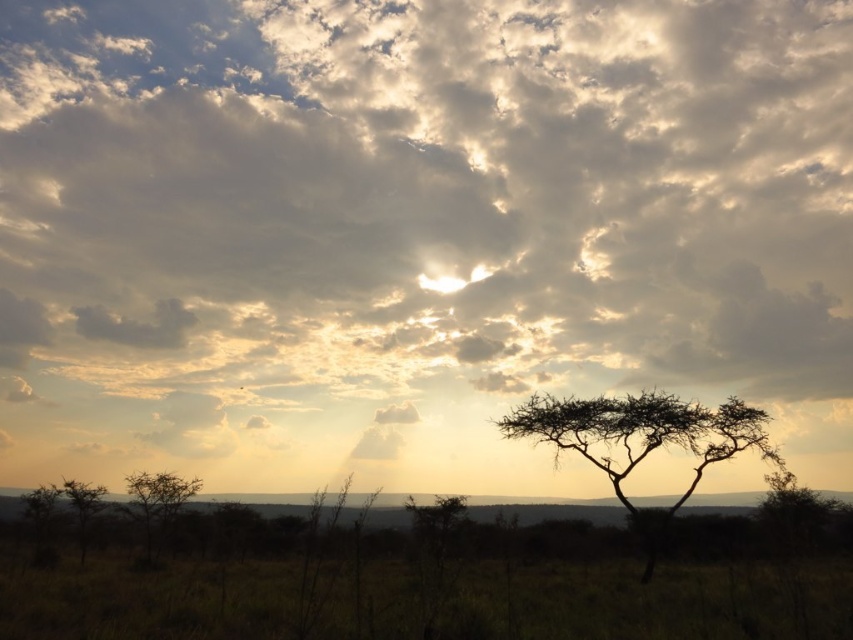
Question: Can you confirm if silhouette wood tree at center is thinner than green leafy tree at lower left?

Choices:
 (A) yes
 (B) no

Answer: (A)

Question: Among these points, which one is nearest to the camera?

Choices:
 (A) (151, 541)
 (B) (711, 438)

Answer: (B)

Question: Among these points, which one is nearest to the camera?

Choices:
 (A) (x=158, y=524)
 (B) (x=537, y=412)

Answer: (B)

Question: Is silhouette wood tree at center thinner than green leafy tree at lower left?

Choices:
 (A) yes
 (B) no

Answer: (A)

Question: Is silhouette wood tree at center behind green leafy tree at lower left?

Choices:
 (A) yes
 (B) no

Answer: (B)